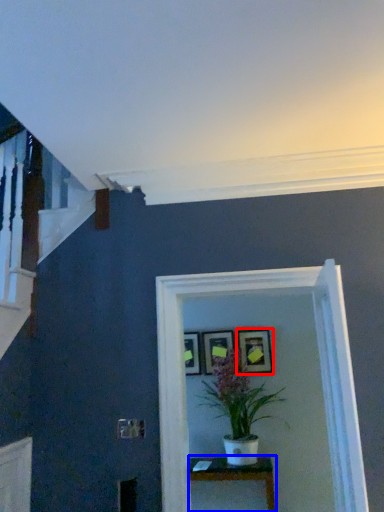
Question: Which point is closer to the camera, picture frame (highlighted by a red box) or table (highlighted by a blue box)?

Choices:
 (A) picture frame
 (B) table

Answer: (B)